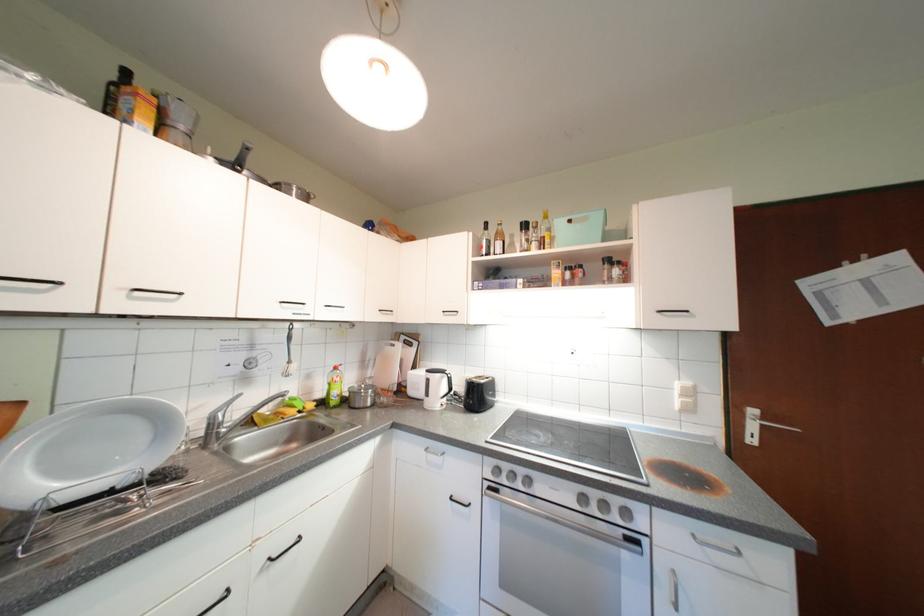
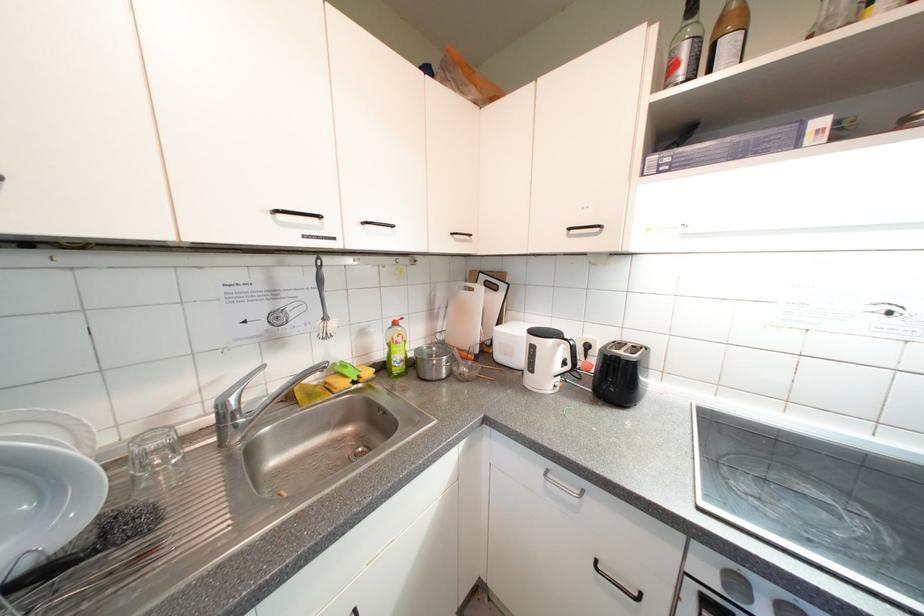
Find the pixel in the second image that matches (490,249) in the first image.

(683, 68)